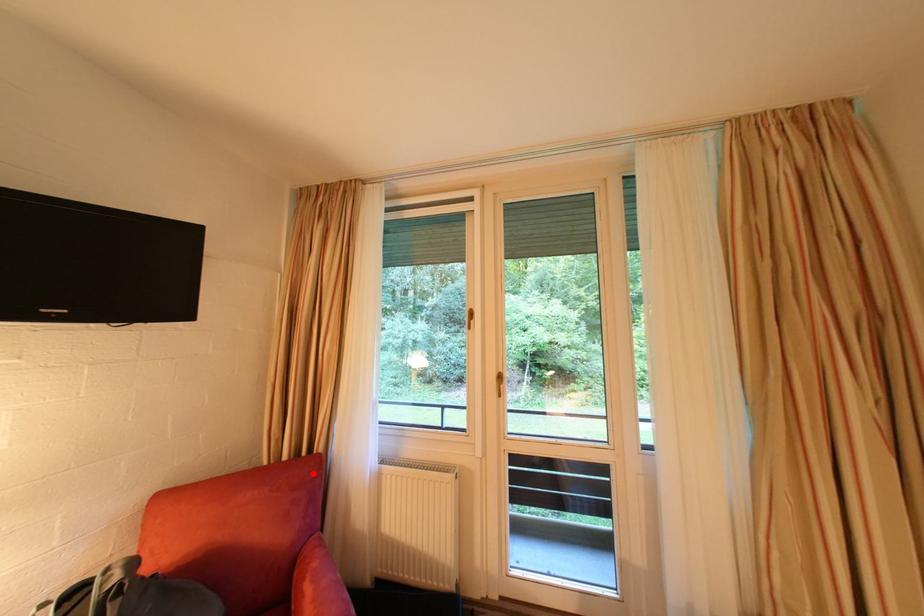
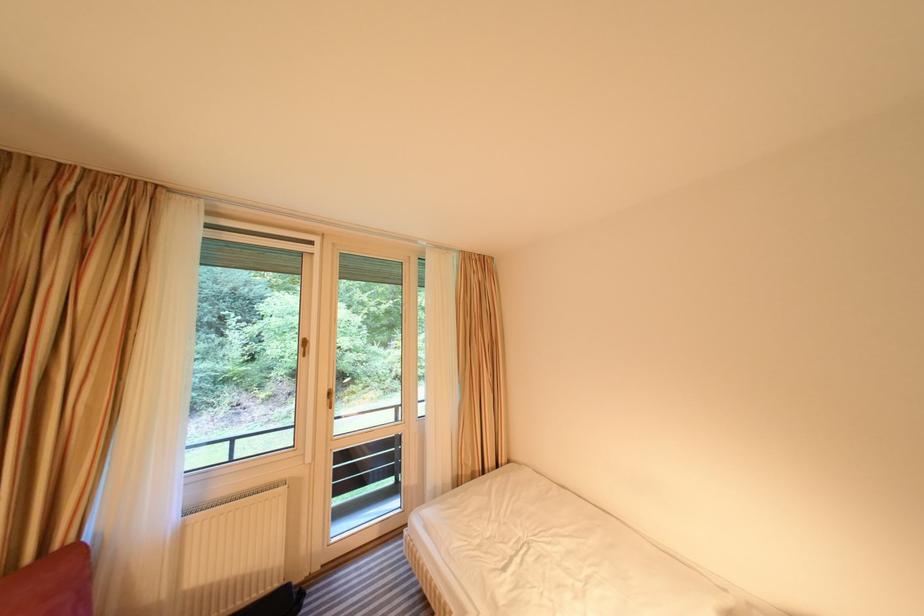
Question: I am providing you with two images of the same scene from different viewpoints. In image1, a red point is highlighted. Considering the same 3D point in image2, which of the following is correct?

Choices:
 (A) It is closer
 (B) It is farther

Answer: (A)